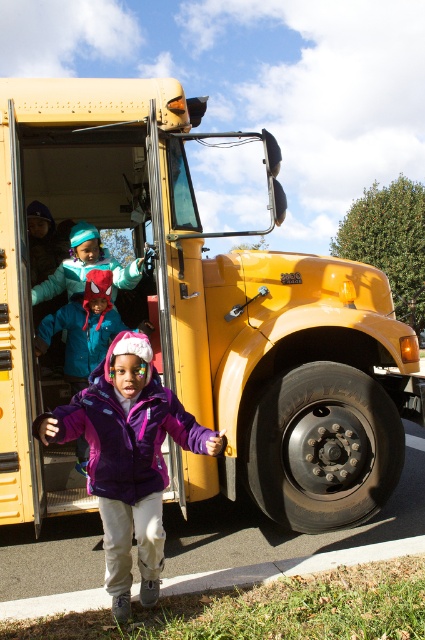
You are a parent trying to locate your child who is wearing a purple fleece jacket at center. From your position at the back of the yellow matte school bus at center, can you see the top of their head?

The yellow matte school bus at center is taller than purple fleece jacket at center, so yes, you can see the top of their head from behind the bus.

You are standing at the point marked as point (200, 317) in the image. What object is directly in front of you?

The yellow matte school bus at center is directly in front of you at point (200, 317).

You are a parent waiting to pick up your child from school. You see the yellow matte school bus at center and the purple fleece jacket at center in the scene. Which object is closer to the right side of the image?

The yellow matte school bus at center is closer to the right side of the image because it is positioned to the right of the purple fleece jacket at center.